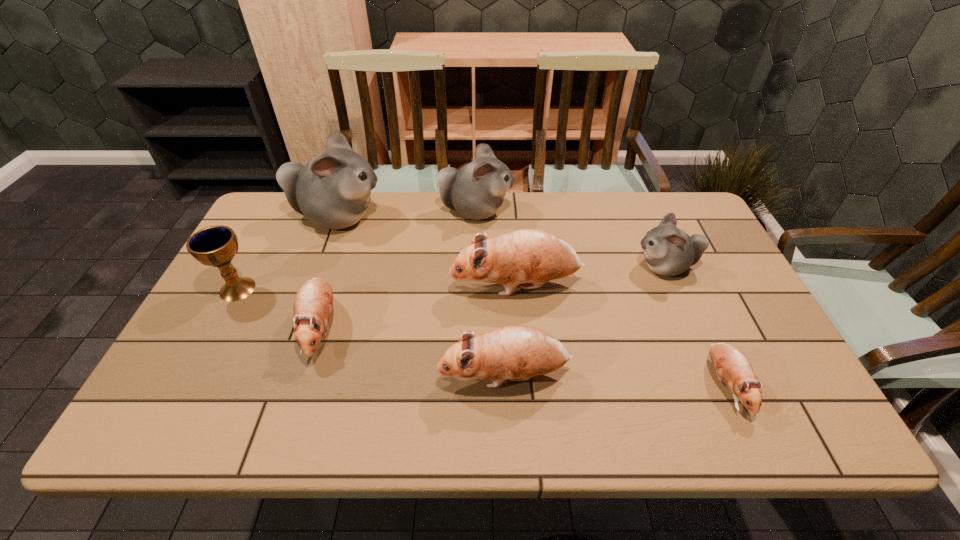
Image resolution: width=960 pixels, height=540 pixels. What are the coordinates of `vacant space at the far edge` in the screenshot? It's located at (416, 221).

Locate an element on the screen. The image size is (960, 540). blank area at the left edge is located at coordinates (196, 333).

Where is `blank space at the right edge of the desktop`? Image resolution: width=960 pixels, height=540 pixels. blank space at the right edge of the desktop is located at coordinates (786, 374).

Where is `vacant space at the far right corner of the desktop`? This screenshot has width=960, height=540. vacant space at the far right corner of the desktop is located at coordinates (654, 221).

Where is `vacant space in between the third smallest brown hamster and the second smallest white hamster`? vacant space in between the third smallest brown hamster and the second smallest white hamster is located at coordinates (491, 294).

Locate an element on the screen. blank region between the second biggest brown hamster and the third biggest brown hamster is located at coordinates (413, 352).

This screenshot has width=960, height=540. Identify the location of empty space between the second white hamster from right to left and the leftmost white hamster. (406, 214).

This screenshot has width=960, height=540. I want to click on unoccupied position between the second smallest white hamster and the second biggest brown hamster, so click(491, 294).

You are a GUI agent. You are given a task and a screenshot of the screen. Output one action in this format:
    pyautogui.click(x=<x>, y=<y>)
    Task: Click on the empty space that is in between the tallest hamster and the second white hamster from right to left
    
    Given the screenshot: What is the action you would take?
    pyautogui.click(x=406, y=214)

Where is `vacant space in between the second smallest brown hamster and the tallest hamster`? The width and height of the screenshot is (960, 540). vacant space in between the second smallest brown hamster and the tallest hamster is located at coordinates (328, 273).